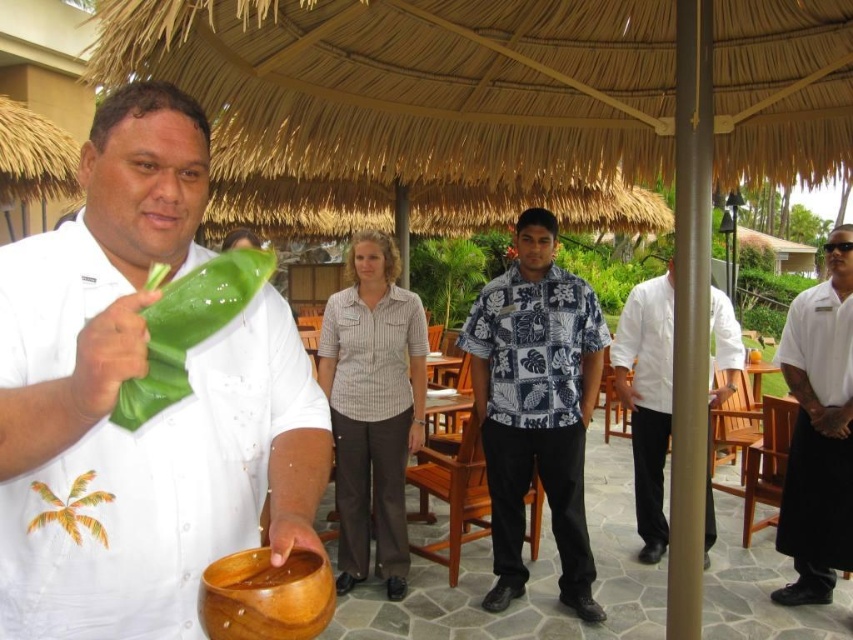
The image size is (853, 640). What do you see at coordinates (189, 328) in the screenshot?
I see `green leafy at center` at bounding box center [189, 328].

The height and width of the screenshot is (640, 853). In order to click on green leafy at center in this screenshot , I will do `click(189, 328)`.

Where is `white shirt at center`? The height and width of the screenshot is (640, 853). white shirt at center is located at coordinates (817, 433).

Can you confirm if white shirt at center is smaller than wooden bowl at lower center?

Incorrect, white shirt at center is not smaller in size than wooden bowl at lower center.

I want to click on white shirt at center, so click(817, 433).

Does white matte shirt at center have a greater height compared to white shirt at center?

No.

Can you confirm if white matte shirt at center is positioned above white shirt at center?

Correct, white matte shirt at center is located above white shirt at center.

What do you see at coordinates (115, 396) in the screenshot? The height and width of the screenshot is (640, 853). I see `white matte shirt at center` at bounding box center [115, 396].

Where is `white matte shirt at center`? The image size is (853, 640). white matte shirt at center is located at coordinates (115, 396).